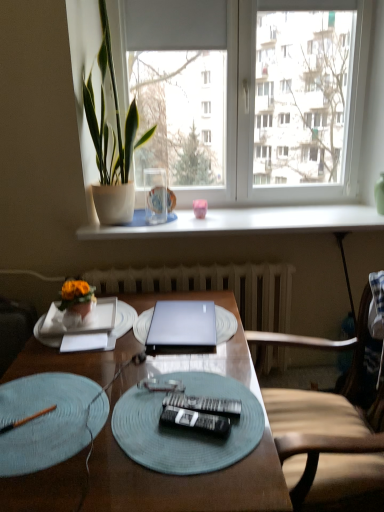
Where is `empty space that is in between black plastic remote control at center, marked as the second remote control in a back-to-front arrangement, and light blue textured placemat at lower left`? This screenshot has height=512, width=384. empty space that is in between black plastic remote control at center, marked as the second remote control in a back-to-front arrangement, and light blue textured placemat at lower left is located at coordinates (139, 425).